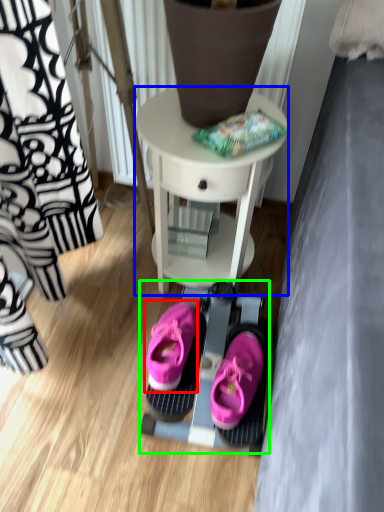
Question: Based on their relative distances, which object is farther from footwear (highlighted by a red box)? Choose from table (highlighted by a blue box) and bunk bed (highlighted by a green box).

Choices:
 (A) table
 (B) bunk bed

Answer: (A)